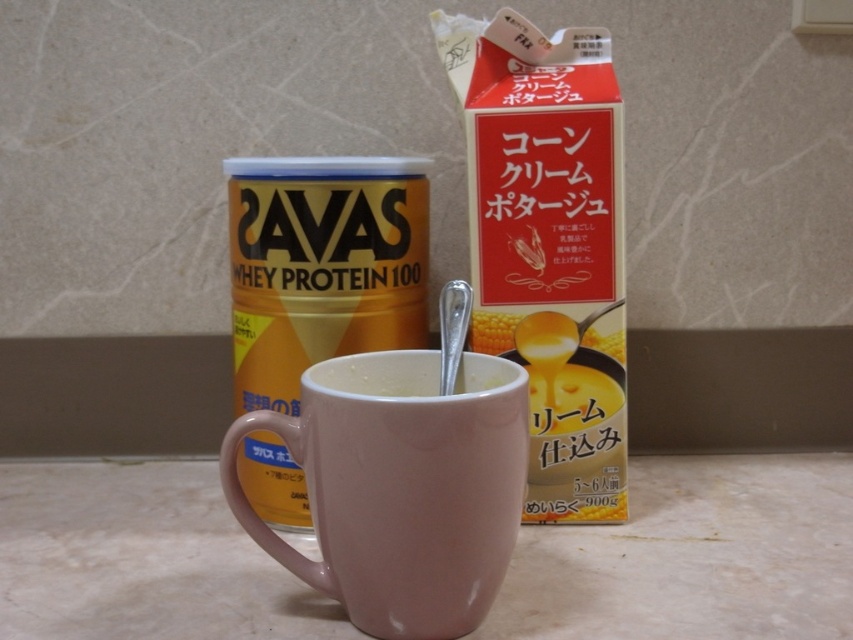
You are preparing to pour a hot drink into either the pink glossy mug at center or the white matte mug at center. Based on their potential widths, which mug could hold a larger volume of liquid without spilling?

The pink glossy mug at center might be wider than the white matte mug at center, so it could potentially hold a larger volume of liquid without spilling if its width allows for a greater capacity.

You are preparing to pour a hot beverage into one of the mugs. Which mug, the matte ceramic mug at center or the white matte mug at center, is more likely to hold more liquid without spilling based on their widths?

The matte ceramic mug at center is wider than the white matte mug at center, so it can hold more liquid without spilling.